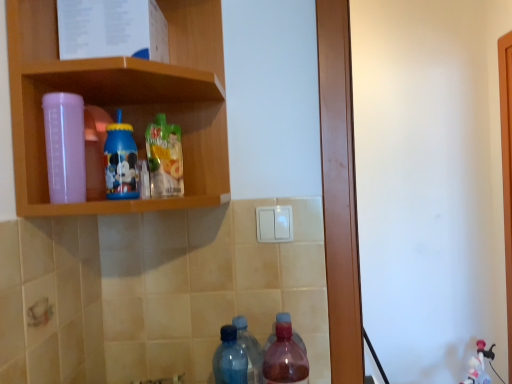
Where is `translucent pink bottle at lower center, acting as the 5th bottle starting from the left`? This screenshot has height=384, width=512. translucent pink bottle at lower center, acting as the 5th bottle starting from the left is located at coordinates (285, 358).

The height and width of the screenshot is (384, 512). Describe the element at coordinates (122, 101) in the screenshot. I see `pink plastic cup at upper left` at that location.

The image size is (512, 384). Find the location of `blue translucent bottle at lower center, the 4th bottle viewed from the left`. blue translucent bottle at lower center, the 4th bottle viewed from the left is located at coordinates (230, 358).

The height and width of the screenshot is (384, 512). What are the coordinates of `blue plastic cup at upper center, positioned as the second bottle in left-to-right order` in the screenshot? It's located at (121, 161).

Identify the location of transparent plastic bottle at upper left, marked as the 1th bottle in a left-to-right arrangement. The width and height of the screenshot is (512, 384). (65, 146).

Is pink plastic cup at upper left placed right next to transparent plastic bottle at upper left, which appears as the fifth bottle when viewed from the right?

No, pink plastic cup at upper left is not touching transparent plastic bottle at upper left, which appears as the fifth bottle when viewed from the right.

Measure the distance from pink plastic cup at upper left to transparent plastic bottle at upper left, which appears as the fifth bottle when viewed from the right.

pink plastic cup at upper left is 15.55 centimeters away from transparent plastic bottle at upper left, which appears as the fifth bottle when viewed from the right.

How different are the orientations of pink plastic cup at upper left and transparent plastic bottle at upper left, which appears as the fifth bottle when viewed from the right, in degrees?

The angle between the facing direction of pink plastic cup at upper left and the facing direction of transparent plastic bottle at upper left, which appears as the fifth bottle when viewed from the right, is 1.88 degrees.

From a real-world perspective, which bottle is the 1st one underneath the pink plastic cup at upper left? Please provide its 2D coordinates.

[(65, 146)]

Considering the sizes of objects translucent pink bottle at lower center, the 1th bottle from the right, and translucent plastic juice at center, the 3th bottle viewed from the right, in the image provided, who is bigger, translucent pink bottle at lower center, the 1th bottle from the right, or translucent plastic juice at center, the 3th bottle viewed from the right,?

translucent pink bottle at lower center, the 1th bottle from the right, is bigger.

Where is `the 2nd bottle to the left of the translucent pink bottle at lower center, acting as the 5th bottle starting from the left, starting your count from the anchor`? the 2nd bottle to the left of the translucent pink bottle at lower center, acting as the 5th bottle starting from the left, starting your count from the anchor is located at coordinates (164, 158).

Considering the relative positions of translucent pink bottle at lower center, acting as the 5th bottle starting from the left, and translucent plastic juice at center, the 3th bottle viewed from the right, in the image provided, is translucent pink bottle at lower center, acting as the 5th bottle starting from the left, behind translucent plastic juice at center, the 3th bottle viewed from the right,?

That is False.

Can you confirm if translucent pink bottle at lower center, acting as the 5th bottle starting from the left, is positioned to the left of translucent plastic juice at center, the 3th bottle viewed from the right?

Incorrect, translucent pink bottle at lower center, acting as the 5th bottle starting from the left, is not on the left side of translucent plastic juice at center, the 3th bottle viewed from the right.

Based on the photo, how distant is translucent pink bottle at lower center, the 1th bottle from the right, from pink plastic cup at upper left?

They are 19.34 inches apart.

From a real-world perspective, is translucent pink bottle at lower center, the 1th bottle from the right, above or below pink plastic cup at upper left?

Clearly, from a real-world perspective, translucent pink bottle at lower center, the 1th bottle from the right, is below pink plastic cup at upper left.

From the image's perspective, does translucent pink bottle at lower center, acting as the 5th bottle starting from the left, appear higher than pink plastic cup at upper left?

Actually, translucent pink bottle at lower center, acting as the 5th bottle starting from the left, appears below pink plastic cup at upper left in the image.

Does point (293, 366) appear closer or farther from the camera than point (12, 9)?

Point (293, 366) is farther from the camera than point (12, 9).

Is translucent plastic juice at center, marked as the 3th bottle in a left-to-right arrangement, not near pink plastic cup at upper left?

That's not correct — translucent plastic juice at center, marked as the 3th bottle in a left-to-right arrangement, is a little close to pink plastic cup at upper left.

Find the location of `shelf on the left of translucent plastic juice at center, the 3th bottle viewed from the right`. shelf on the left of translucent plastic juice at center, the 3th bottle viewed from the right is located at coordinates (122, 101).

From the picture: Does translucent plastic juice at center, marked as the 3th bottle in a left-to-right arrangement, have a greater width compared to pink plastic cup at upper left?

In fact, translucent plastic juice at center, marked as the 3th bottle in a left-to-right arrangement, might be narrower than pink plastic cup at upper left.

Can you tell me how much transparent plastic bottle at upper left, which appears as the fifth bottle when viewed from the right, and translucent plastic juice at center, the 3th bottle viewed from the right, differ in facing direction?

0.0057 degrees separate the facing orientations of transparent plastic bottle at upper left, which appears as the fifth bottle when viewed from the right, and translucent plastic juice at center, the 3th bottle viewed from the right.

From the picture: Is transparent plastic bottle at upper left, which appears as the fifth bottle when viewed from the right, to the right of translucent plastic juice at center, marked as the 3th bottle in a left-to-right arrangement, from the viewer's perspective?

No, transparent plastic bottle at upper left, which appears as the fifth bottle when viewed from the right, is not to the right of translucent plastic juice at center, marked as the 3th bottle in a left-to-right arrangement.

Starting from the transparent plastic bottle at upper left, marked as the 1th bottle in a left-to-right arrangement, which bottle is the 4th one behind? Please provide its 2D coordinates.

[(164, 158)]

Does point (59, 185) come behind point (173, 143)?

That is False.

How different are the orientations of transparent plastic bottle at upper left, which appears as the fifth bottle when viewed from the right, and pink plastic cup at upper left in degrees?

The facing directions of transparent plastic bottle at upper left, which appears as the fifth bottle when viewed from the right, and pink plastic cup at upper left are 1.88 degrees apart.

Considering the sizes of objects transparent plastic bottle at upper left, which appears as the fifth bottle when viewed from the right, and pink plastic cup at upper left in the image provided, who is shorter, transparent plastic bottle at upper left, which appears as the fifth bottle when viewed from the right, or pink plastic cup at upper left?

transparent plastic bottle at upper left, which appears as the fifth bottle when viewed from the right.

Is transparent plastic bottle at upper left, which appears as the fifth bottle when viewed from the right, in front of or behind pink plastic cup at upper left in the image?

transparent plastic bottle at upper left, which appears as the fifth bottle when viewed from the right, is behind pink plastic cup at upper left.

From the image's perspective, which one is positioned higher, transparent plastic bottle at upper left, marked as the 1th bottle in a left-to-right arrangement, or pink plastic cup at upper left?

pink plastic cup at upper left.

From the image's perspective, which bottle is the 2nd one above the transparent plastic bottle at upper left, which appears as the fifth bottle when viewed from the right? Please provide its 2D coordinates.

[(164, 158)]

Which of these two, translucent plastic juice at center, the 3th bottle viewed from the right, or transparent plastic bottle at upper left, marked as the 1th bottle in a left-to-right arrangement, is thinner?

transparent plastic bottle at upper left, marked as the 1th bottle in a left-to-right arrangement, is thinner.

Looking at this image, is translucent plastic juice at center, marked as the 3th bottle in a left-to-right arrangement, positioned with its back to transparent plastic bottle at upper left, which appears as the fifth bottle when viewed from the right?

No, translucent plastic juice at center, marked as the 3th bottle in a left-to-right arrangement, is not facing the opposite direction of transparent plastic bottle at upper left, which appears as the fifth bottle when viewed from the right.

From a real-world perspective, is translucent plastic juice at center, the 3th bottle viewed from the right, located beneath transparent plastic bottle at upper left, which appears as the fifth bottle when viewed from the right?

Yes.

The width and height of the screenshot is (512, 384). I want to click on shelf in front of the transparent plastic bottle at upper left, marked as the 1th bottle in a left-to-right arrangement, so (122, 101).

From the image's perspective, count 4th bottles downward from the translucent plastic juice at center, the 3th bottle viewed from the right, and point to it. Please provide its 2D coordinates.

[(285, 358)]

When comparing their distances from blue translucent bottle at lower center, acting as the second bottle starting from the right, does blue plastic cup at upper center, positioned as the second bottle in left-to-right order, or translucent pink bottle at lower center, acting as the 5th bottle starting from the left, seem closer?

The object closer to blue translucent bottle at lower center, acting as the second bottle starting from the right, is translucent pink bottle at lower center, acting as the 5th bottle starting from the left.

Looking at the image, which one is located closer to blue translucent bottle at lower center, the 4th bottle viewed from the left, blue plastic cup at upper center, which ranks as the 4th bottle in right-to-left order, or pink plastic cup at upper left?

Among the two, blue plastic cup at upper center, which ranks as the 4th bottle in right-to-left order, is located nearer to blue translucent bottle at lower center, the 4th bottle viewed from the left.

Looking at the image, which one is located further to translucent pink bottle at lower center, the 1th bottle from the right, translucent plastic juice at center, the 3th bottle viewed from the right, or transparent plastic bottle at upper left, marked as the 1th bottle in a left-to-right arrangement?

Based on the image, transparent plastic bottle at upper left, marked as the 1th bottle in a left-to-right arrangement, appears to be further to translucent pink bottle at lower center, the 1th bottle from the right.

Looking at the image, which one is located further to translucent pink bottle at lower center, acting as the 5th bottle starting from the left, blue plastic cup at upper center, positioned as the second bottle in left-to-right order, or pink plastic cup at upper left?

pink plastic cup at upper left.

When comparing their distances from blue translucent bottle at lower center, the 4th bottle viewed from the left, does pink plastic cup at upper left or translucent plastic juice at center, marked as the 3th bottle in a left-to-right arrangement, seem further?

Among the two, pink plastic cup at upper left is located further to blue translucent bottle at lower center, the 4th bottle viewed from the left.

Estimate the real-world distances between objects in this image. Which object is closer to pink plastic cup at upper left, translucent plastic juice at center, marked as the 3th bottle in a left-to-right arrangement, or blue plastic cup at upper center, positioned as the second bottle in left-to-right order?

translucent plastic juice at center, marked as the 3th bottle in a left-to-right arrangement, lies closer to pink plastic cup at upper left than the other object.

From the image, which object appears to be nearer to blue plastic cup at upper center, positioned as the second bottle in left-to-right order, pink plastic cup at upper left or blue translucent bottle at lower center, the 4th bottle viewed from the left?

pink plastic cup at upper left.

Estimate the real-world distances between objects in this image. Which object is further from translucent pink bottle at lower center, acting as the 5th bottle starting from the left, pink plastic cup at upper left or translucent plastic juice at center, marked as the 3th bottle in a left-to-right arrangement?

Among the two, pink plastic cup at upper left is located further to translucent pink bottle at lower center, acting as the 5th bottle starting from the left.

Locate an element on the screen. bottle between transparent plastic bottle at upper left, which appears as the fifth bottle when viewed from the right, and translucent pink bottle at lower center, acting as the 5th bottle starting from the left, from top to bottom is located at coordinates (230, 358).

At what (x,y) coordinates should I click in order to perform the action: click on bottle between blue plastic cup at upper center, positioned as the second bottle in left-to-right order, and blue translucent bottle at lower center, the 4th bottle viewed from the left, vertically. Please return your answer as a coordinate pair (x, y). Image resolution: width=512 pixels, height=384 pixels. Looking at the image, I should click on (65, 146).